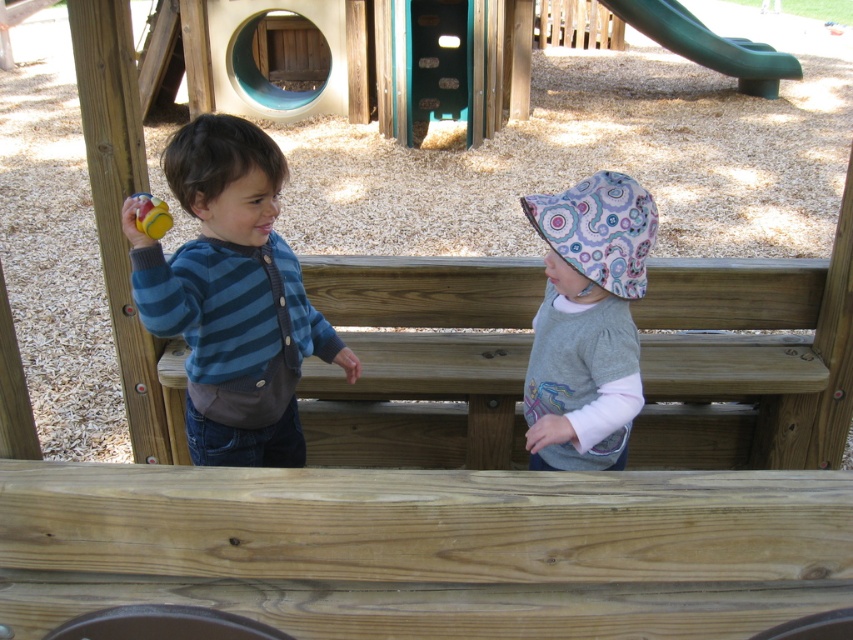
You are a photographer trying to capture a closeup of the patterned fabric hat at center. Based on the coordinates provided, where should you position your camera to ensure the hat is centered in your shot?

The patterned fabric hat at center is located at coordinates point [587,323], so positioning the camera to center on those coordinates will ensure the hat is centered in the shot.

You are a parent at the playground and want to ensure the blue striped sweater at left and the yellow rubber ball at left are both visible in your photo. Which object should you zoom in on to capture both without cropping?

The blue striped sweater at left is wider than the yellow rubber ball at left, so you should zoom in on the blue striped sweater at left to ensure both are visible without cropping.